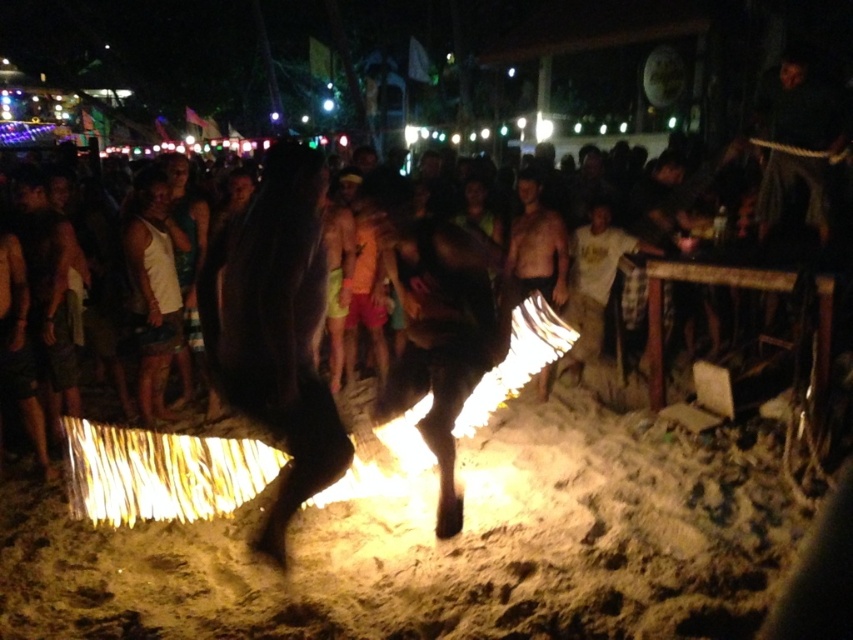
Who is lower down, white cotton shirt at center or shiny black skin at center?

white cotton shirt at center is below.

Locate an element on the screen. The height and width of the screenshot is (640, 853). white cotton shirt at center is located at coordinates (593, 282).